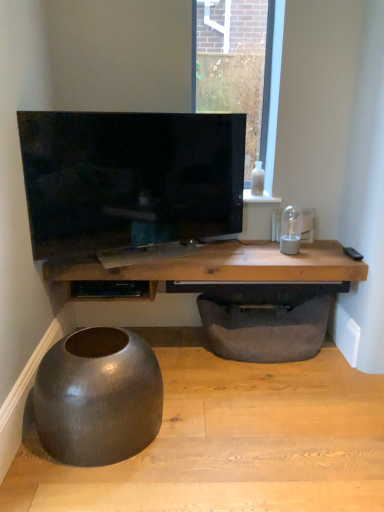
Question: In terms of height, does white glossy bottle at upper right look taller or shorter compared to wooden table at center?

Choices:
 (A) tall
 (B) short

Answer: (B)

Question: From a real-world perspective, is white glossy bottle at upper right positioned above or below wooden table at center?

Choices:
 (A) above
 (B) below

Answer: (A)

Question: Based on their relative distances, which object is farther from the matte black bowl at lower left?

Choices:
 (A) matte black shelf at center
 (B) white glossy bottle at upper right
 (C) wooden table at center
 (D) matte black tv at center
 (E) matte gray concrete at lower left

Answer: (B)

Question: Estimate the real-world distances between objects in this image. Which object is closer to the matte black shelf at center?

Choices:
 (A) matte black bowl at lower left
 (B) wooden table at center
 (C) matte black tv at center
 (D) white glossy bottle at upper right
 (E) dark gray fabric footrest at lower center

Answer: (B)